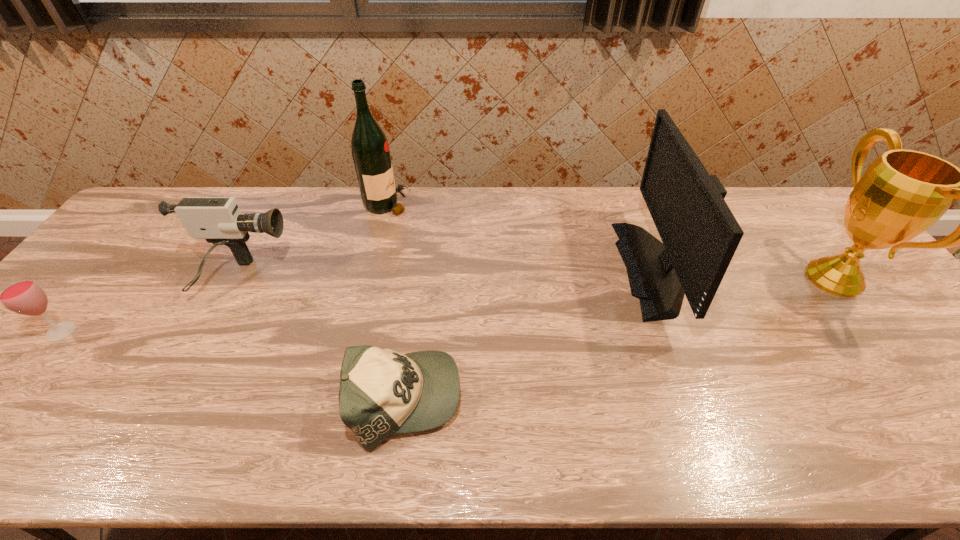
Identify the location of vacant region located 0.230m on the front-facing side of the award. The image size is (960, 540). (721, 278).

Image resolution: width=960 pixels, height=540 pixels. I want to click on free point located on the front-facing side of the award, so click(703, 278).

The width and height of the screenshot is (960, 540). What are the coordinates of `vacant space located on the front-facing side of the award` in the screenshot? It's located at (759, 278).

Find the location of a particular element. free space located 0.380m on the screen side of the fifth object from left to right is located at coordinates (491, 268).

Image resolution: width=960 pixels, height=540 pixels. I want to click on free location located 0.330m on the screen side of the fifth object from left to right, so 508,268.

Identify the location of blank area located on the screen side of the fifth object from left to right. (602, 268).

Image resolution: width=960 pixels, height=540 pixels. I want to click on free location located 0.310m on the recording direction of the fourth tallest object, so click(397, 278).

Find the location of a particular element. free region located on the back of the leftmost object is located at coordinates (145, 230).

The image size is (960, 540). In order to click on free point located on the front-facing side of the baseball cap in this screenshot , I will do `click(640, 399)`.

Where is `wine bottle that is at the far edge`? The height and width of the screenshot is (540, 960). wine bottle that is at the far edge is located at coordinates (370, 150).